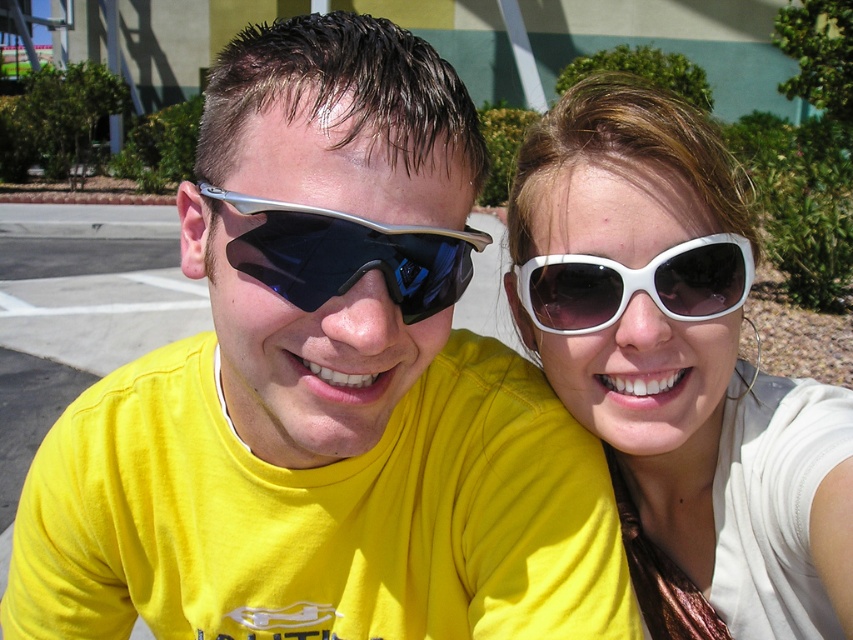
Between white matte sunglasses at upper right and matte black goggles at center, which one appears on the left side from the viewer's perspective?

Positioned to the left is matte black goggles at center.

Between point (611, 152) and point (309, 260), which one is positioned behind?

The point (611, 152) is behind.

You are a GUI agent. You are given a task and a screenshot of the screen. Output one action in this format:
    pyautogui.click(x=<x>, y=<y>)
    Task: Click on the white matte sunglasses at upper right
    The height and width of the screenshot is (640, 853).
    Given the screenshot: What is the action you would take?
    pyautogui.click(x=677, y=369)

Is matte black goggles at center to the left of white plastic sunglasses at upper right from the viewer's perspective?

Correct, you'll find matte black goggles at center to the left of white plastic sunglasses at upper right.

I want to click on matte black goggles at center, so click(347, 253).

Identify the location of matte black goggles at center. This screenshot has height=640, width=853. (347, 253).

Does point (198, 202) lie behind point (695, 296)?

No, it is not.

Can you confirm if matte yellow t-shirt at center is positioned to the right of white plastic sunglasses at upper right?

Incorrect, matte yellow t-shirt at center is not on the right side of white plastic sunglasses at upper right.

Who is more distant from viewer, (231,234) or (543,273)?

The point (543,273) is behind.

Locate an element on the screen. The image size is (853, 640). matte yellow t-shirt at center is located at coordinates (323, 392).